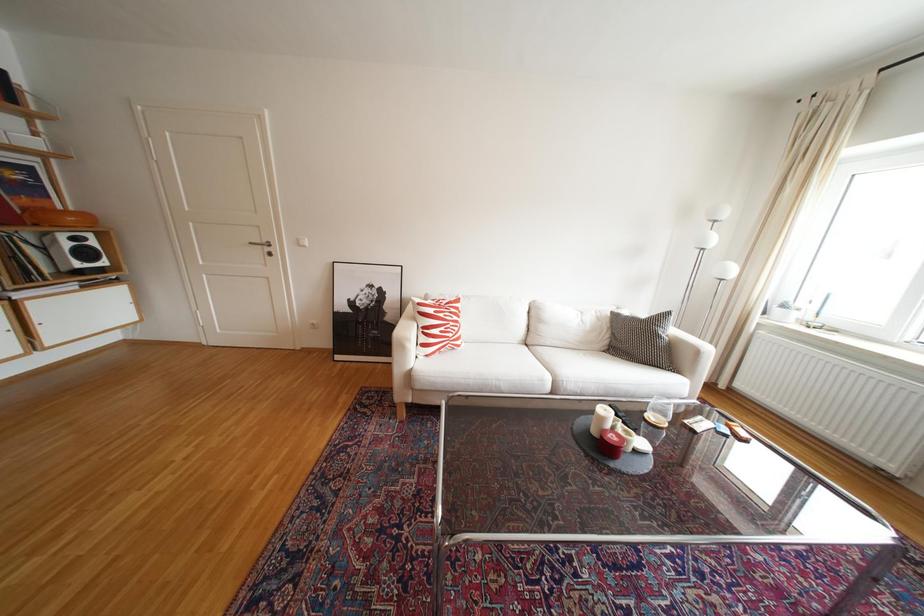
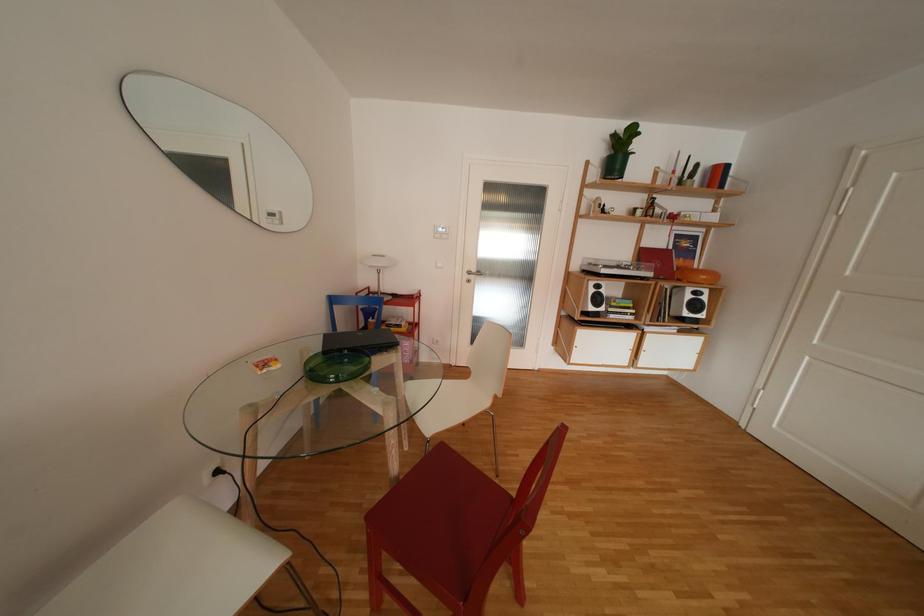
Question: Based on the continuous images, in which direction is the camera rotating? Reply with the corresponding letter.

Choices:
 (A) Left
 (B) Right
 (C) Up
 (D) Down

Answer: (A)